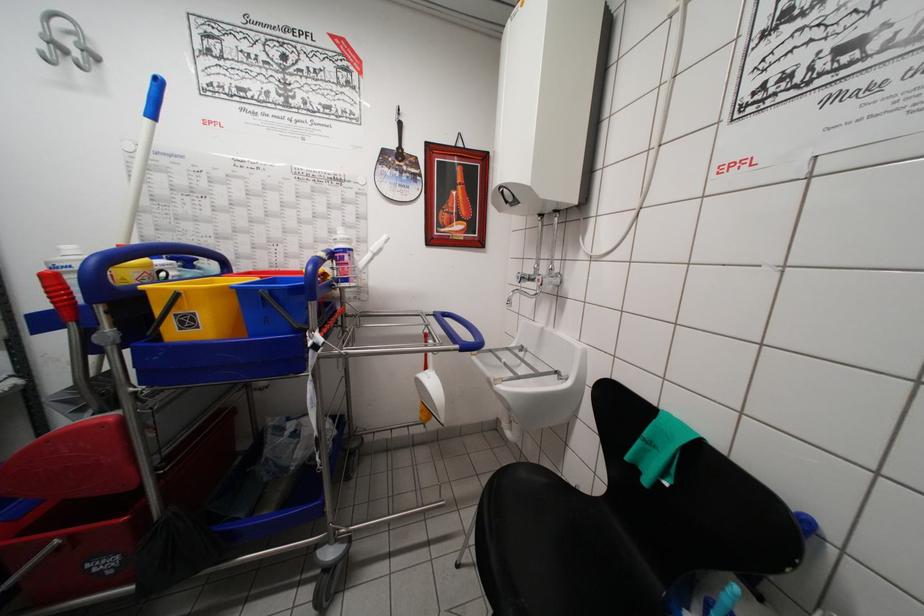
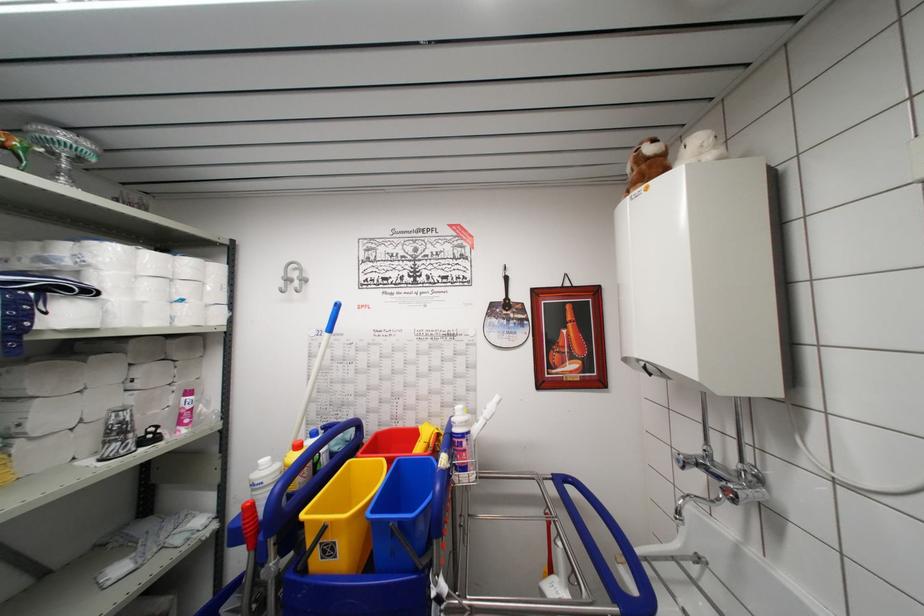
In the second image, find the point that corresponds to (92,51) in the first image.

(307, 280)